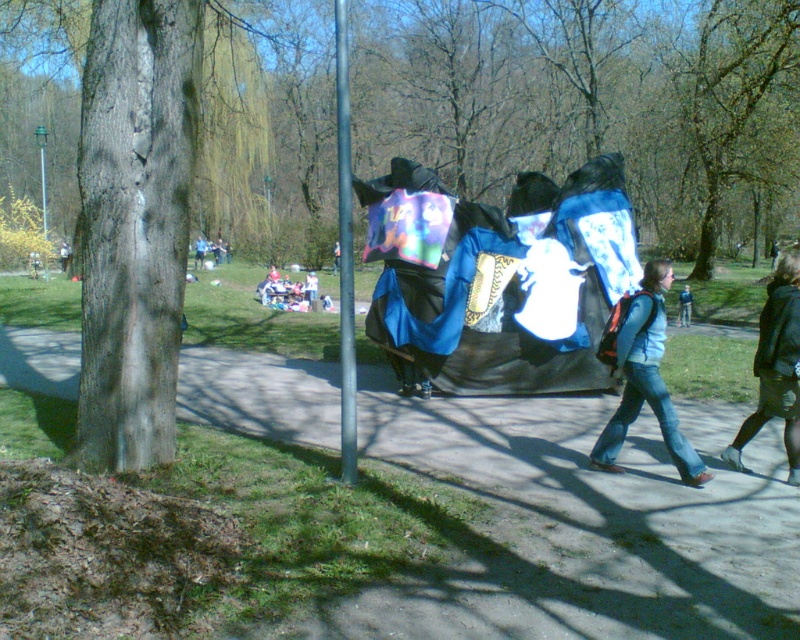
Between point (660, 296) and point (200, 250), which one is positioned in front?

Positioned in front is point (660, 296).

Is blue jeans at center to the left of blue fabric at center from the viewer's perspective?

Incorrect, blue jeans at center is not on the left side of blue fabric at center.

Who is more forward, [692,467] or [204,244]?

Point [692,467]

Find the location of a particular element. blue jeans at center is located at coordinates (645, 380).

Which is above, paved concrete sidewalk at center or silver metallic pole at center?

silver metallic pole at center is higher up.

Is paved concrete sidewalk at center taller than silver metallic pole at center?

No, paved concrete sidewalk at center is not taller than silver metallic pole at center.

Is point (501, 499) more distant than point (340, 24)?

Yes, point (501, 499) is behind point (340, 24).

Where is `paved concrete sidewalk at center`? paved concrete sidewalk at center is located at coordinates (580, 529).

Is silver metallic pole at center positioned behind blue fabric backpack at center-right?

No, silver metallic pole at center is in front of blue fabric backpack at center-right.

Is silver metallic pole at center shorter than blue fabric backpack at center-right?

In fact, silver metallic pole at center may be taller than blue fabric backpack at center-right.

The height and width of the screenshot is (640, 800). What do you see at coordinates (345, 253) in the screenshot?
I see `silver metallic pole at center` at bounding box center [345, 253].

Identify the location of silver metallic pole at center. The image size is (800, 640). (345, 253).